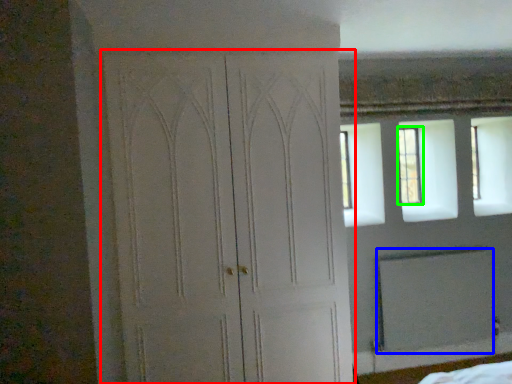
Question: Based on their relative distances, which object is nearer to door (highlighted by a red box)? Choose from screen door (highlighted by a blue box) and window (highlighted by a green box).

Choices:
 (A) screen door
 (B) window

Answer: (A)